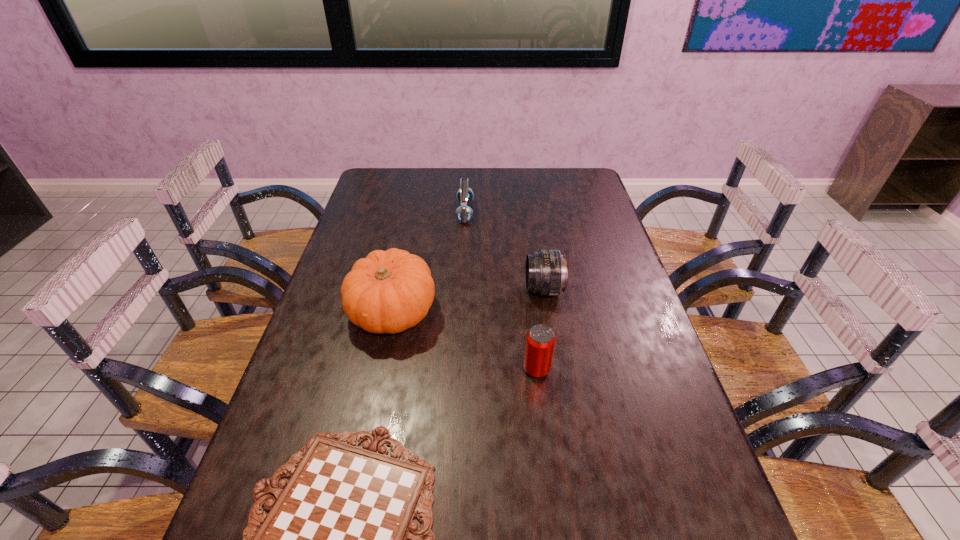
The image size is (960, 540). Find the location of `vacant area that lies between the farthest object and the tallest object`. vacant area that lies between the farthest object and the tallest object is located at coordinates (429, 262).

Locate an element on the screen. free space between the headset and the second nearest object is located at coordinates (501, 291).

Locate which object is the second closest to the nearest object. Please provide its 2D coordinates. Your answer should be formatted as a tuple, i.e. [(x, y)], where the tuple contains the x and y coordinates of a point satisfying the conditions above.

[(389, 291)]

Select which object appears as the second closest to the can. Please provide its 2D coordinates. Your answer should be formatted as a tuple, i.e. [(x, y)], where the tuple contains the x and y coordinates of a point satisfying the conditions above.

[(340, 539)]

Where is `free space in the image that satisfies the following two spatial constraints: 1. on the ear cups of the headset; 2. on the left side of the fourth farthest object`? The width and height of the screenshot is (960, 540). free space in the image that satisfies the following two spatial constraints: 1. on the ear cups of the headset; 2. on the left side of the fourth farthest object is located at coordinates (458, 369).

Locate an element on the screen. This screenshot has height=540, width=960. vacant space that satisfies the following two spatial constraints: 1. on the front side of the second nearest object; 2. on the left side of the tallest object is located at coordinates (380, 369).

Find the location of a particular element. The width and height of the screenshot is (960, 540). vacant region that satisfies the following two spatial constraints: 1. on the ear cups of the headset; 2. on the left side of the can is located at coordinates (458, 369).